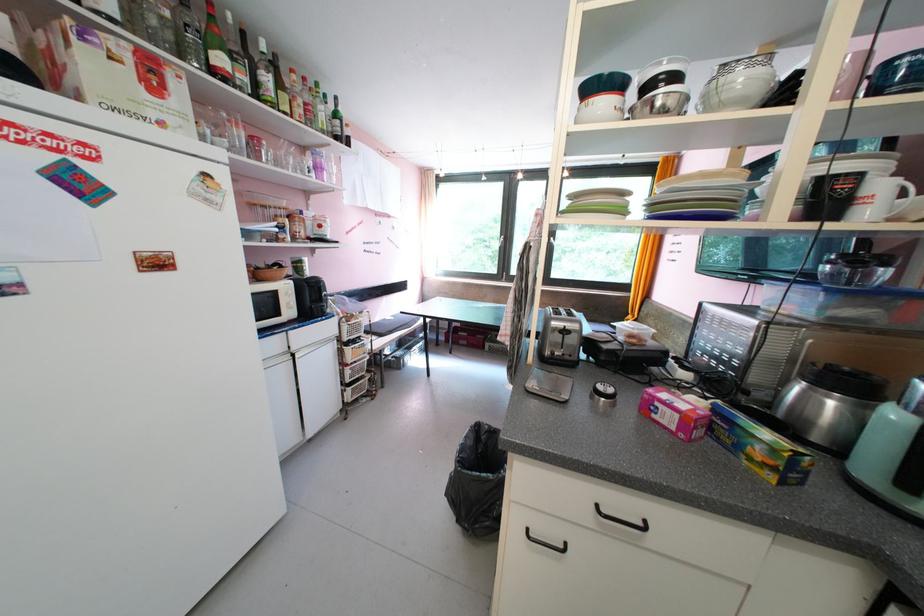
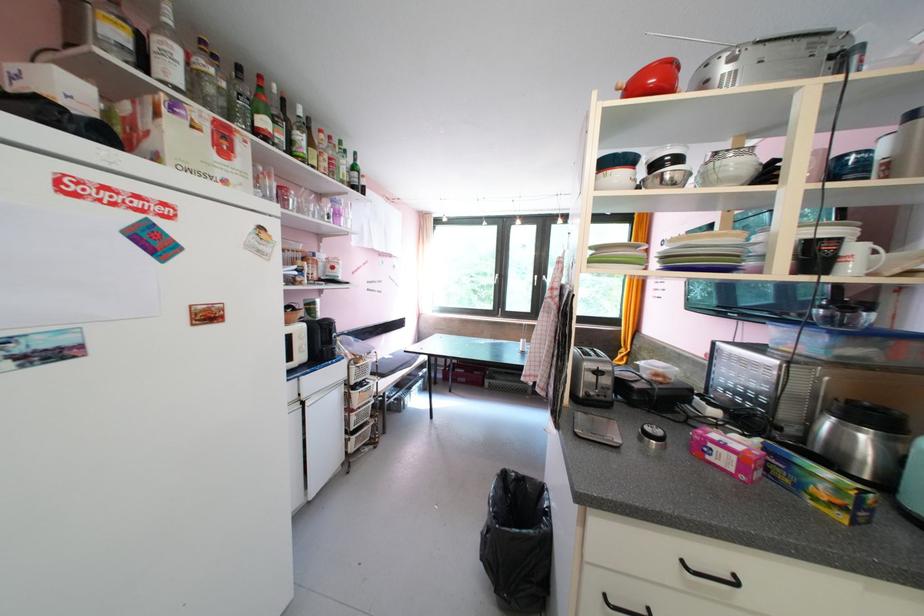
The point at (663, 418) is marked in the first image. Where is the corresponding point in the second image?

(716, 460)